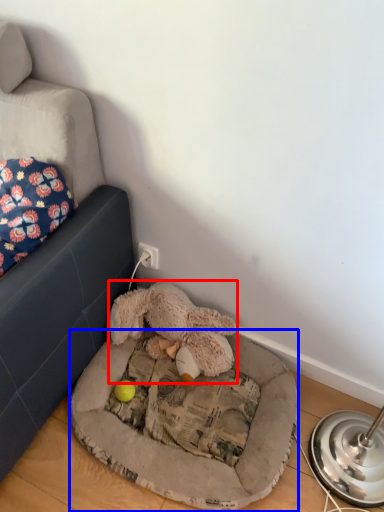
Question: Which point is closer to the camera, toy (highlighted by a red box) or dog bed (highlighted by a blue box)?

Choices:
 (A) toy
 (B) dog bed

Answer: (B)